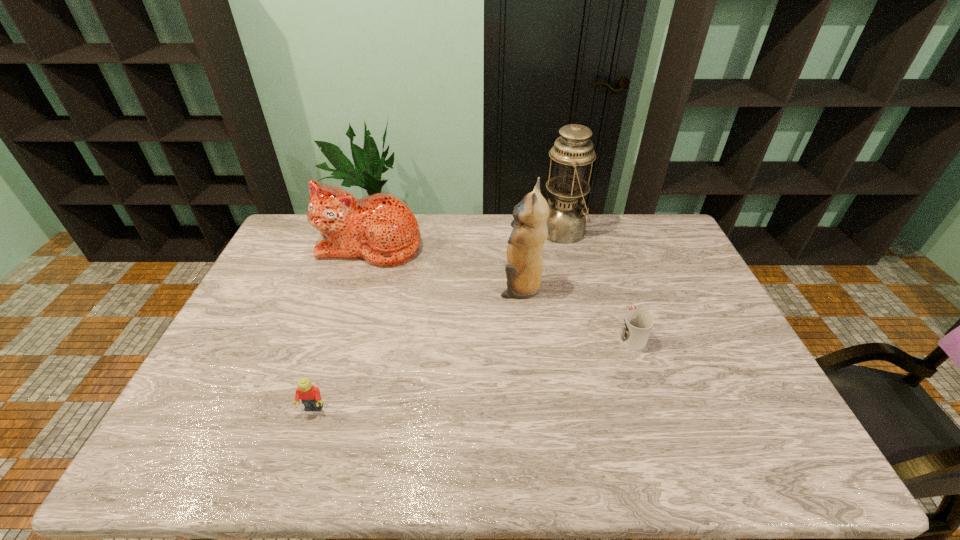
Image resolution: width=960 pixels, height=540 pixels. Find the location of `vacant region between the farther cat and the nearest object`. vacant region between the farther cat and the nearest object is located at coordinates pyautogui.click(x=342, y=327).

The height and width of the screenshot is (540, 960). What are the coordinates of `free space between the farther cat and the fourth tallest object` in the screenshot? It's located at (342, 327).

Identify the location of free spot between the third tallest object and the nearest object. (342, 327).

Where is `empty location between the shorter cat and the second shortest object`? empty location between the shorter cat and the second shortest object is located at coordinates (342, 327).

The image size is (960, 540). I want to click on unoccupied position between the shorter cat and the right cat, so click(445, 266).

Identify the location of object that ranks as the closest to the shortest object. This screenshot has height=540, width=960. (524, 270).

The height and width of the screenshot is (540, 960). I want to click on the second closest object to the Lego, so click(524, 270).

You are a GUI agent. You are given a task and a screenshot of the screen. Output one action in this format:
    pyautogui.click(x=<x>, y=<y>)
    Task: Click on the free space that satisfies the following two spatial constraints: 1. on the handle side of the cup; 2. on the face of the taller cat
    
    Given the screenshot: What is the action you would take?
    pyautogui.click(x=614, y=287)

Where is `free spot that satisfies the following two spatial constraints: 1. on the handle side of the shortest object; 2. on the face of the third farthest object`? This screenshot has width=960, height=540. free spot that satisfies the following two spatial constraints: 1. on the handle side of the shortest object; 2. on the face of the third farthest object is located at coordinates (614, 287).

Where is `vacant area that satisfies the following two spatial constraints: 1. on the face of the right cat; 2. on the face of the nearest object`? This screenshot has width=960, height=540. vacant area that satisfies the following two spatial constraints: 1. on the face of the right cat; 2. on the face of the nearest object is located at coordinates (533, 409).